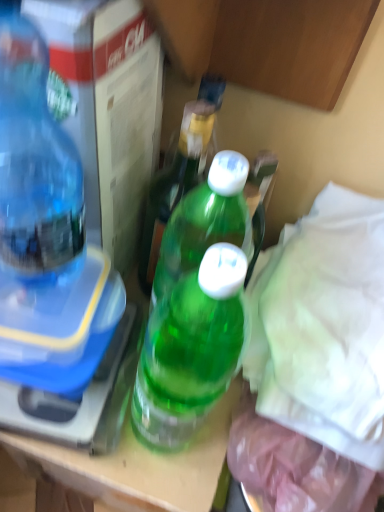
Question: Is green plastic bottle at center, which is counted as the 2th bottle, starting from the left, bigger or smaller than transparent plastic bottle at left, placed as the 2th bottle when sorted from right to left?

Choices:
 (A) small
 (B) big

Answer: (A)

Question: Considering the positions of green plastic bottle at center, which appears as the 1th bottle when viewed from the right, and transparent plastic bottle at left, placed as the 2th bottle when sorted from right to left, in the image, is green plastic bottle at center, which appears as the 1th bottle when viewed from the right, taller or shorter than transparent plastic bottle at left, placed as the 2th bottle when sorted from right to left,?

Choices:
 (A) tall
 (B) short

Answer: (B)

Question: From a real-world perspective, relative to transparent plastic bottle at left, placed as the 2th bottle when sorted from right to left, is green plastic bottle at center, which appears as the 1th bottle when viewed from the right, vertically above or below?

Choices:
 (A) above
 (B) below

Answer: (B)

Question: In the image, is transparent plastic bottle at left, placed as the 2th bottle when sorted from right to left, positioned in front of or behind green plastic bottle at center, which appears as the 1th bottle when viewed from the right?

Choices:
 (A) front
 (B) behind

Answer: (A)

Question: From a real-world perspective, is transparent plastic bottle at left, placed as the 2th bottle when sorted from right to left, positioned above or below green plastic bottle at center, which is counted as the 2th bottle, starting from the left?

Choices:
 (A) above
 (B) below

Answer: (A)

Question: Is point pos(3,183) closer or farther from the camera than point pos(160,194)?

Choices:
 (A) farther
 (B) closer

Answer: (B)

Question: Is transparent plastic bottle at left, placed as the 2th bottle when sorted from right to left, inside the boundaries of green plastic bottle at center, which appears as the 1th bottle when viewed from the right, or outside?

Choices:
 (A) outside
 (B) inside

Answer: (A)